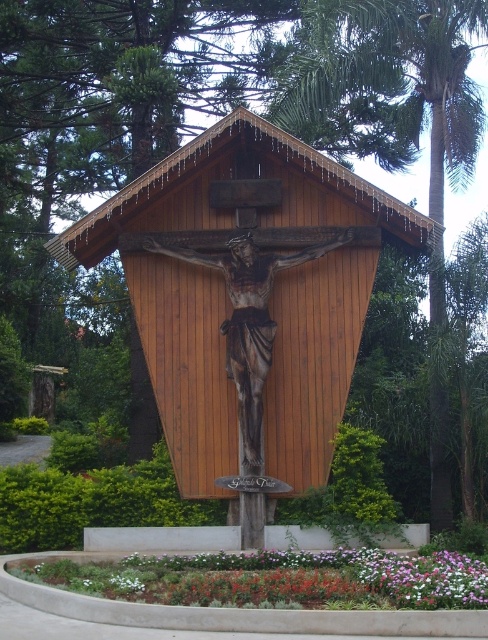
Please provide the 2D coordinates of the wooden crucifix at center in the image.

The wooden crucifix at center is located at the coordinates of point [226,289].

You are standing in front of the wooden crucifix at center and the white matte flower at lower center. Which object is positioned to the left?

The white matte flower at lower center is positioned to the left of the wooden crucifix at center.

You are standing in front of the wooden crucifix at center and the green leafy palm tree at center. Which object is positioned higher in the image?

The wooden crucifix at center is positioned higher than the green leafy palm tree at center.